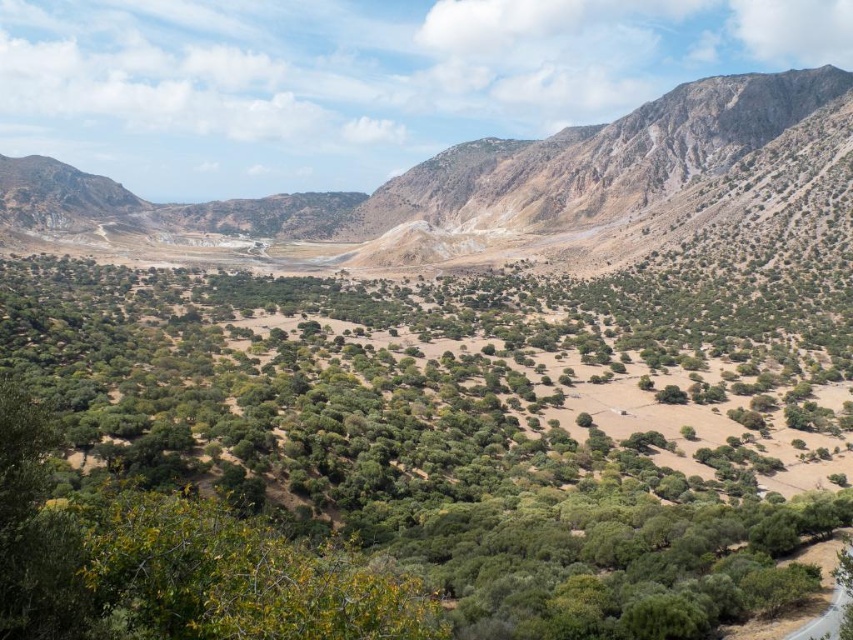
Question: Does green leafy trees at center come behind dull brown rocky mountain at upper right?

Choices:
 (A) yes
 (B) no

Answer: (B)

Question: Which point is closer to the camera taking this photo?

Choices:
 (A) (460, 500)
 (B) (612, 196)

Answer: (A)

Question: Which of the following is the closest to the observer?

Choices:
 (A) (68, 346)
 (B) (21, 161)

Answer: (A)

Question: Can you confirm if green leafy trees at center is positioned below dull brown rocky mountain at upper right?

Choices:
 (A) yes
 (B) no

Answer: (A)

Question: Is green leafy trees at center further to camera compared to dull brown rocky mountain at upper right?

Choices:
 (A) yes
 (B) no

Answer: (B)

Question: Which point is farther to the camera?

Choices:
 (A) dull brown rocky mountain at upper right
 (B) green leafy trees at center

Answer: (A)